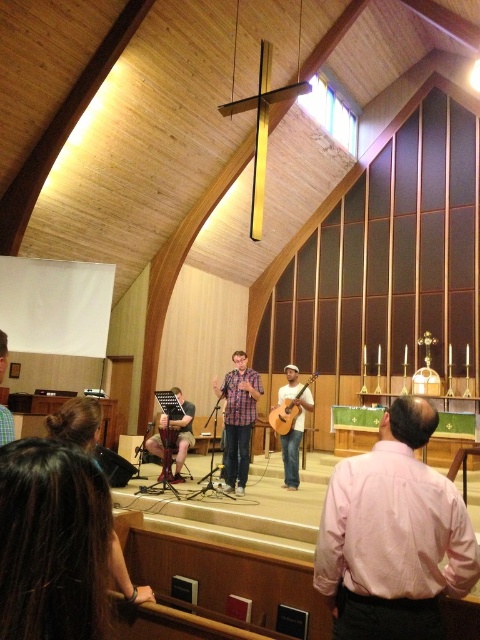
Question: Is plaid shirt at center below acoustic wood guitar at center?

Choices:
 (A) no
 (B) yes

Answer: (B)

Question: Which object is farther from the camera taking this photo?

Choices:
 (A) acoustic wood guitar at center
 (B) plaid shirt at center
 (C) pink cotton shirt at center

Answer: (A)

Question: Which point is closer to the camera?

Choices:
 (A) (309, 392)
 (B) (387, 588)

Answer: (B)

Question: Does plaid shirt at center appear on the right side of matte white guitar at center?

Choices:
 (A) yes
 (B) no

Answer: (B)

Question: Which of the following is the farthest from the observer?

Choices:
 (A) acoustic wood guitar at center
 (B) pink cotton shirt at center
 (C) wooden planks at center
 (D) matte white guitar at center

Answer: (C)

Question: Does matte white guitar at center appear on the left side of wooden planks at center?

Choices:
 (A) no
 (B) yes

Answer: (A)